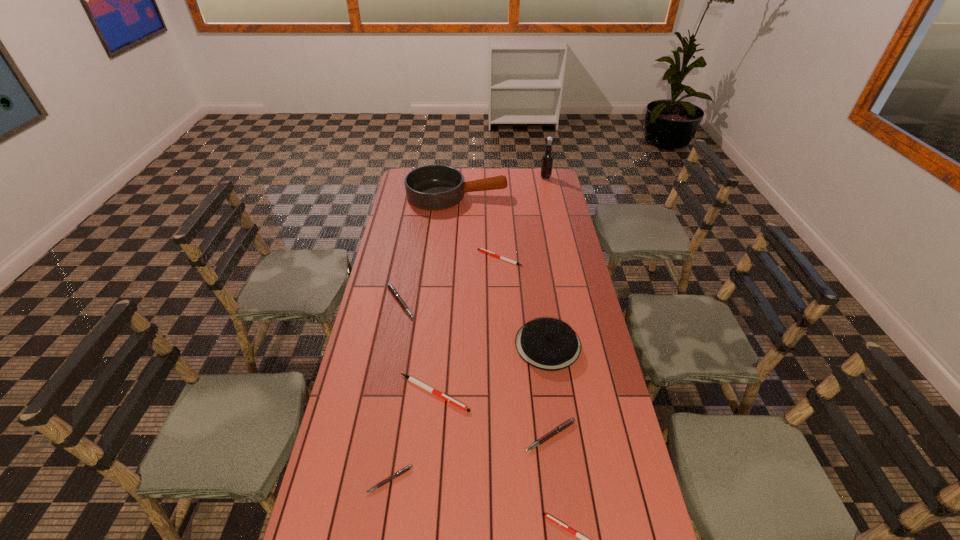
I want to click on root beer positioned at the right edge, so click(x=547, y=160).

The width and height of the screenshot is (960, 540). In order to click on pancake present at the right edge in this screenshot , I will do `click(549, 344)`.

The height and width of the screenshot is (540, 960). I want to click on pen that is at the right edge, so click(557, 430).

Find the location of a particular element. object at the far left corner is located at coordinates (432, 187).

This screenshot has width=960, height=540. What are the coordinates of `object that is at the far right corner` in the screenshot? It's located at (547, 160).

Image resolution: width=960 pixels, height=540 pixels. In the image, there is a desktop. In order to click on free region at the far edge in this screenshot , I will do [488, 176].

I want to click on vacant space at the left edge of the desktop, so click(399, 279).

The image size is (960, 540). Find the location of `free space between the smallest pink pen and the farthest object`. free space between the smallest pink pen and the farthest object is located at coordinates coord(468,329).

Where is `vacant space that's between the seventh farthest object and the eighth shortest object`? vacant space that's between the seventh farthest object and the eighth shortest object is located at coordinates (504, 316).

I want to click on object that is the fifth nearest to the root beer, so click(410, 378).